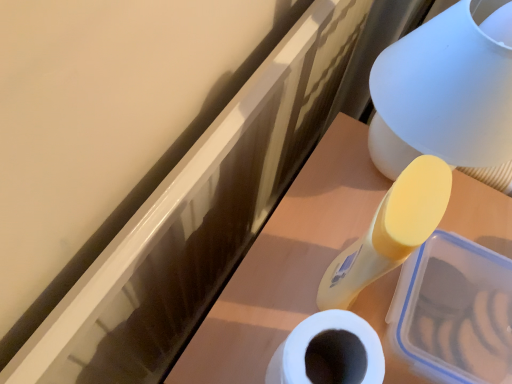
Where is `free space that is to the left of matte white table lamp at upper right`? free space that is to the left of matte white table lamp at upper right is located at coordinates (320, 193).